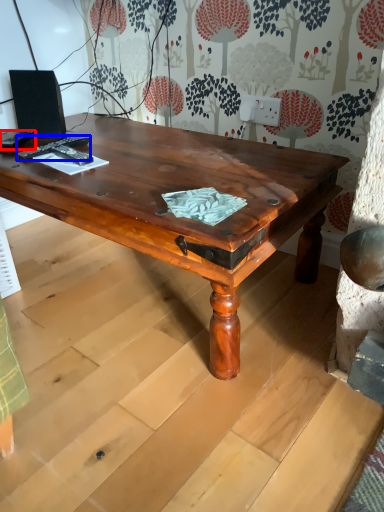
Question: Which of the following is the closest to the observer, remote control (highlighted by a red box) or remote control (highlighted by a blue box)?

Choices:
 (A) remote control
 (B) remote control

Answer: (B)